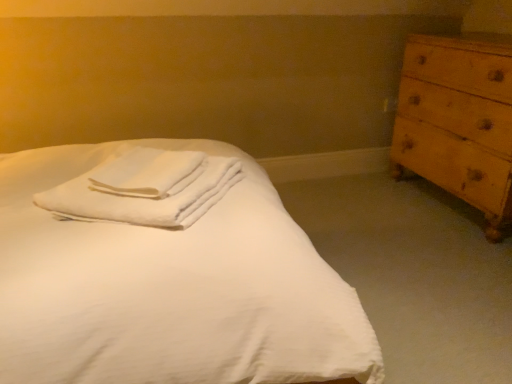
Question: From the image's perspective, is white cotton towels at center located above white smooth bed at center?

Choices:
 (A) no
 (B) yes

Answer: (B)

Question: Does white cotton towels at center have a lesser width compared to white smooth bed at center?

Choices:
 (A) no
 (B) yes

Answer: (B)

Question: Is white cotton towels at center wider than white smooth bed at center?

Choices:
 (A) yes
 (B) no

Answer: (B)

Question: Is white cotton towels at center at the left side of white smooth bed at center?

Choices:
 (A) yes
 (B) no

Answer: (B)

Question: Is white cotton towels at center further to camera compared to white smooth bed at center?

Choices:
 (A) no
 (B) yes

Answer: (B)

Question: From the image's perspective, is white cotton towels at center located beneath white smooth bed at center?

Choices:
 (A) no
 (B) yes

Answer: (A)

Question: Does wooden chest of drawers at right lie behind white soft towel at center?

Choices:
 (A) yes
 (B) no

Answer: (A)

Question: From a real-world perspective, is wooden chest of drawers at right on white soft towel at center?

Choices:
 (A) yes
 (B) no

Answer: (B)

Question: Is wooden chest of drawers at right smaller than white soft towel at center?

Choices:
 (A) yes
 (B) no

Answer: (B)

Question: Is wooden chest of drawers at right not within white soft towel at center?

Choices:
 (A) yes
 (B) no

Answer: (A)

Question: Is wooden chest of drawers at right closer to camera compared to white soft towel at center?

Choices:
 (A) yes
 (B) no

Answer: (B)

Question: Does wooden chest of drawers at right have a greater width compared to white soft towel at center?

Choices:
 (A) yes
 (B) no

Answer: (A)

Question: Is white cotton towels at center with white soft towel at center?

Choices:
 (A) no
 (B) yes

Answer: (B)